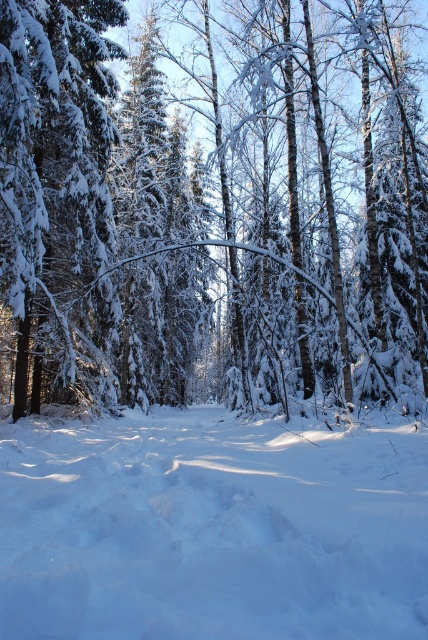
Question: Is white snow-covered tree at center wider than white fluffy snow at center?

Choices:
 (A) yes
 (B) no

Answer: (A)

Question: Which point is farther from the camera taking this photo?

Choices:
 (A) (395, 432)
 (B) (362, 205)

Answer: (B)

Question: Among these points, which one is nearest to the camera?

Choices:
 (A) (26, 339)
 (B) (309, 525)

Answer: (B)

Question: Where is white snow-covered tree at center located in relation to white fluffy snow at center in the image?

Choices:
 (A) left
 (B) right

Answer: (B)

Question: Can you confirm if white snow-covered tree at center is positioned below white fluffy snow at center?

Choices:
 (A) no
 (B) yes

Answer: (A)